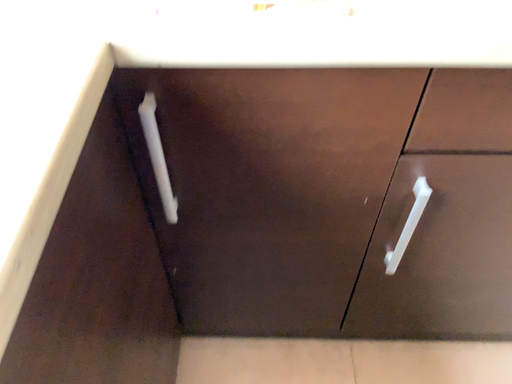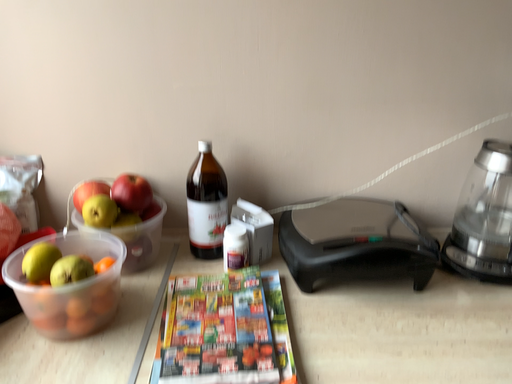
Question: How did the camera likely rotate when shooting the video?

Choices:
 (A) rotated upward
 (B) rotated downward

Answer: (A)